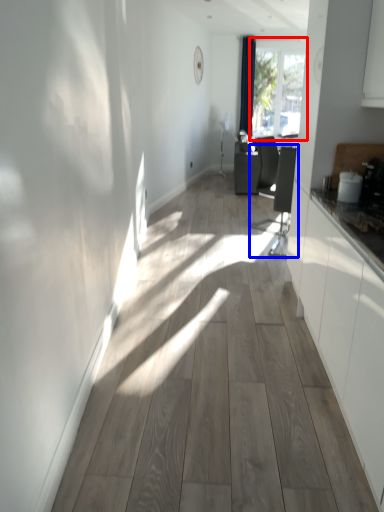
Question: Which object appears farthest to the camera in this image, window (highlighted by a red box) or swivel chair (highlighted by a blue box)?

Choices:
 (A) window
 (B) swivel chair

Answer: (A)